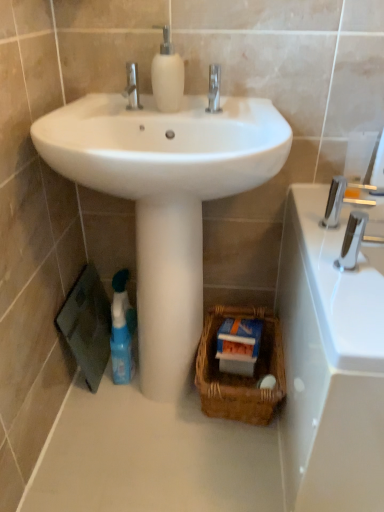
Find the location of a particular element. The image size is (384, 512). free point to the right of white glossy soap dispenser at center is located at coordinates (245, 119).